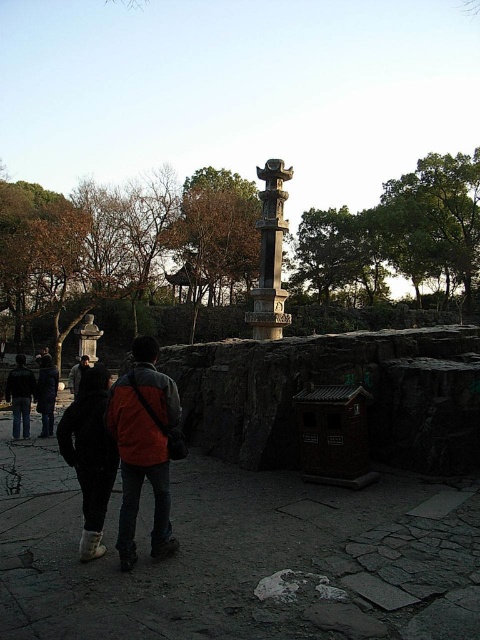
You are a photographer trying to capture a photo of the traditional stone monument in the park. You notice an orange fabric jacket at lower left and dark gray jeans at center in your frame. If you want to focus solely on the monument, which object should you move closer to the camera to avoid?

To focus solely on the monument, you should move the orange fabric jacket at lower left closer to the camera since it is closer to the dark gray jeans at center and thus closer to the camera than the monument.

You are a photographer standing at the edge of the park. You want to take a photo of the polished stone monument at center without the orange fabric jacket at lower left appearing in the foreground. Is the jacket currently positioned in a way that would block your view of the monument?

The orange fabric jacket at lower left is below the polished stone monument at center, so it is positioned in the foreground and would block your view of the monument in the photo.